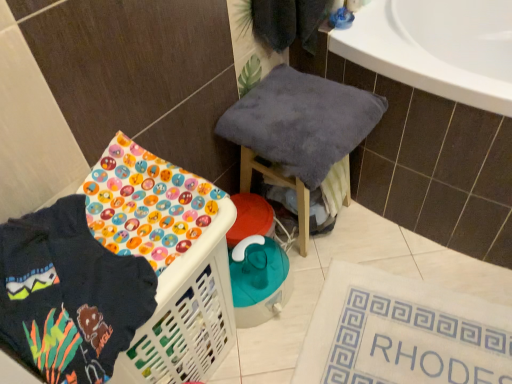
Question: Is point (331, 291) positioned closer to the camera than point (115, 273)?

Choices:
 (A) closer
 (B) farther

Answer: (B)

Question: From a real-world perspective, relative to dark blue fleece sweatshirt at lower left, is white fabric bath mat at lower right vertically above or below?

Choices:
 (A) below
 (B) above

Answer: (A)

Question: Estimate the real-world distances between objects in this image. Which object is farther from the white fabric bath mat at lower right?

Choices:
 (A) dark blue fleece sweatshirt at lower left
 (B) soft gray towel at center

Answer: (A)

Question: Estimate the real-world distances between objects in this image. Which object is closer to the soft gray towel at center?

Choices:
 (A) dark blue fleece sweatshirt at lower left
 (B) white fabric bath mat at lower right

Answer: (B)